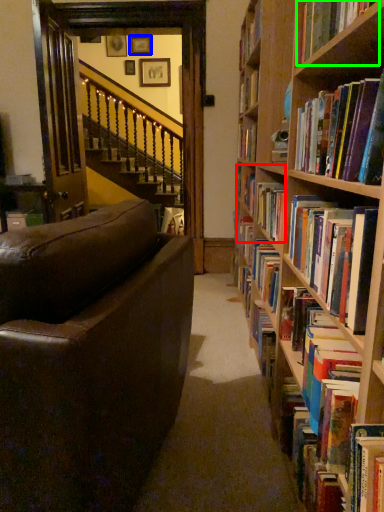
Question: Which is farther away from book (highlighted by a red box)? picture frame (highlighted by a blue box) or book (highlighted by a green box)?

Choices:
 (A) picture frame
 (B) book

Answer: (A)